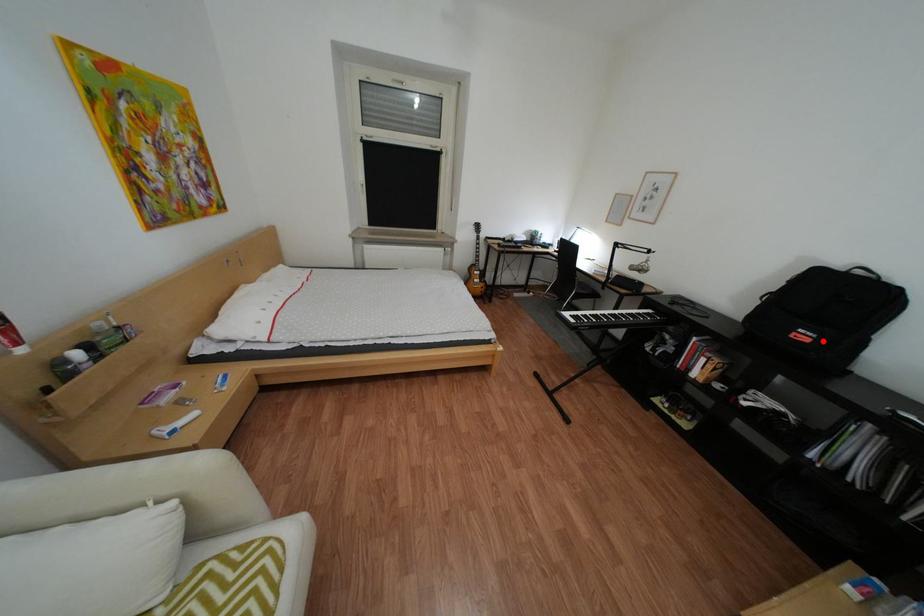
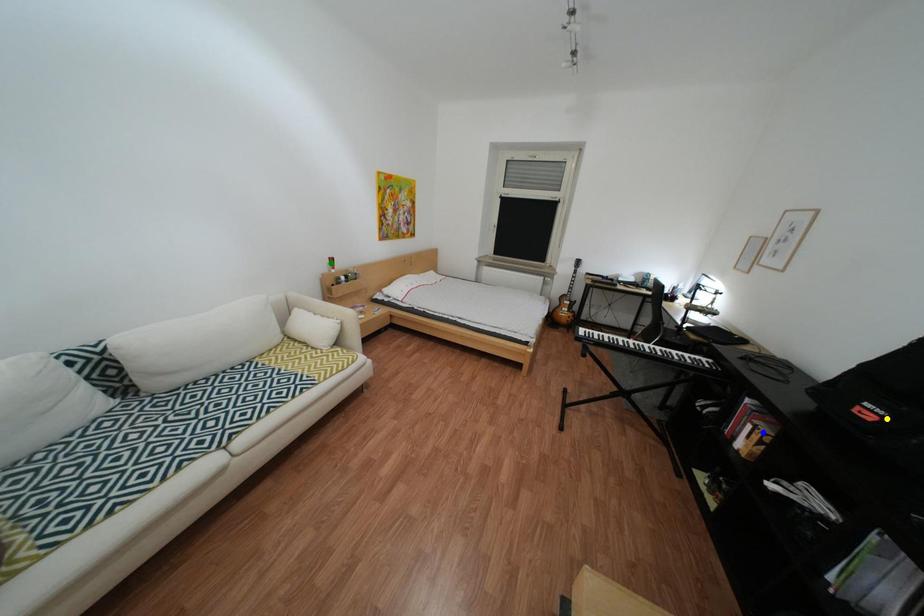
Question: I am providing you with two images of the same scene from different viewpoints. A red point is marked on the first image. You are given multiple points on the second image. Which point in image 2 is actually the same real-world point as the red point in image 1?

Choices:
 (A) blue point
 (B) green point
 (C) yellow point

Answer: (C)